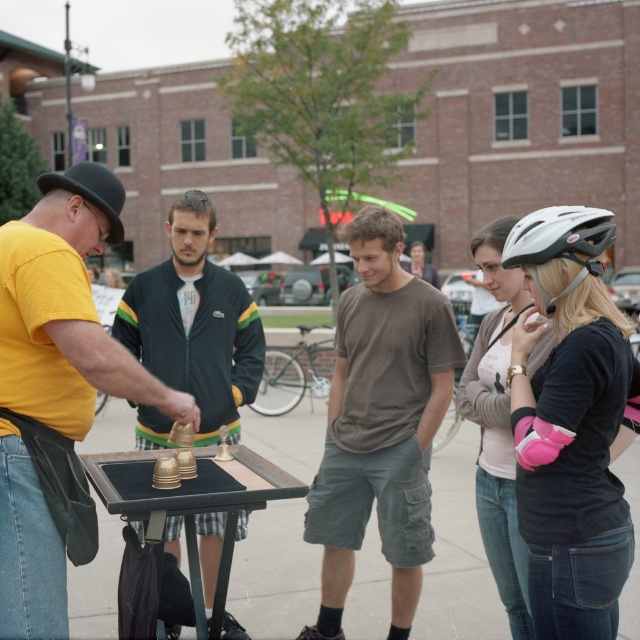
Question: Among these objects, which one is nearest to the camera?

Choices:
 (A) yellow matte shirt at left
 (B) white matte bicycle helmet at upper right
 (C) black jacket at center

Answer: (B)

Question: Does yellow matte shirt at left appear under black jacket at center?

Choices:
 (A) no
 (B) yes

Answer: (B)

Question: Is the position of brown cotton t-shirt at center more distant than that of black jacket at center?

Choices:
 (A) yes
 (B) no

Answer: (B)

Question: Which point is closer to the camera taking this photo?

Choices:
 (A) (163, 346)
 (B) (56, 385)

Answer: (B)

Question: Estimate the real-world distances between objects in this image. Which object is closer to the brown cotton t-shirt at center?

Choices:
 (A) yellow matte shirt at left
 (B) black jacket at center

Answer: (B)

Question: Is black jacket at center smaller than white matte bicycle helmet at upper right?

Choices:
 (A) yes
 (B) no

Answer: (B)